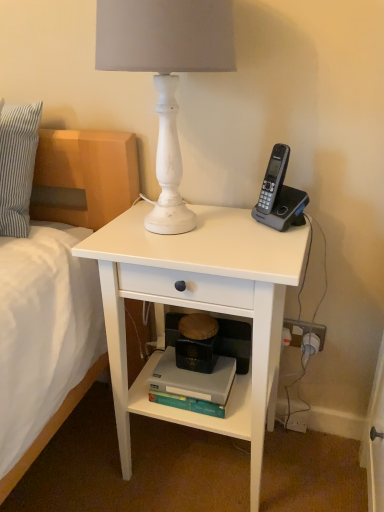
Question: Is white matte lamp at upper center positioned before gray plastic phone at upper right?

Choices:
 (A) yes
 (B) no

Answer: (A)

Question: From the image's perspective, is white matte lamp at upper center under gray plastic phone at upper right?

Choices:
 (A) yes
 (B) no

Answer: (B)

Question: Considering the relative positions of white matte lamp at upper center and gray plastic phone at upper right in the image provided, is white matte lamp at upper center behind gray plastic phone at upper right?

Choices:
 (A) no
 (B) yes

Answer: (A)

Question: Considering the relative sizes of white matte lamp at upper center and gray plastic phone at upper right in the image provided, is white matte lamp at upper center wider than gray plastic phone at upper right?

Choices:
 (A) no
 (B) yes

Answer: (B)

Question: Is white matte lamp at upper center at the left side of gray plastic phone at upper right?

Choices:
 (A) no
 (B) yes

Answer: (B)

Question: Looking at the image, does white plastic power outlet at lower right seem bigger or smaller compared to white matte lamp at upper center?

Choices:
 (A) small
 (B) big

Answer: (A)

Question: Which is correct: white plastic power outlet at lower right is inside white matte lamp at upper center, or outside of it?

Choices:
 (A) inside
 (B) outside

Answer: (B)

Question: Considering the relative positions of white plastic power outlet at lower right and white matte lamp at upper center in the image provided, is white plastic power outlet at lower right to the left or to the right of white matte lamp at upper center?

Choices:
 (A) right
 (B) left

Answer: (A)

Question: Is white plastic power outlet at lower right wider or thinner than white matte lamp at upper center?

Choices:
 (A) thin
 (B) wide

Answer: (A)

Question: Is hardcover book at lower center inside or outside of gray plastic phone at upper right?

Choices:
 (A) outside
 (B) inside

Answer: (A)

Question: Is hardcover book at lower center wider or thinner than gray plastic phone at upper right?

Choices:
 (A) thin
 (B) wide

Answer: (B)

Question: In the image, is hardcover book at lower center on the left side or the right side of gray plastic phone at upper right?

Choices:
 (A) left
 (B) right

Answer: (A)

Question: Relative to gray plastic phone at upper right, is hardcover book at lower center in front or behind?

Choices:
 (A) behind
 (B) front

Answer: (A)

Question: In terms of size, does gray plastic phone at upper right appear bigger or smaller than hardcover book at lower center?

Choices:
 (A) small
 (B) big

Answer: (A)

Question: Visually, is gray plastic phone at upper right positioned to the left or to the right of hardcover book at lower center?

Choices:
 (A) right
 (B) left

Answer: (A)